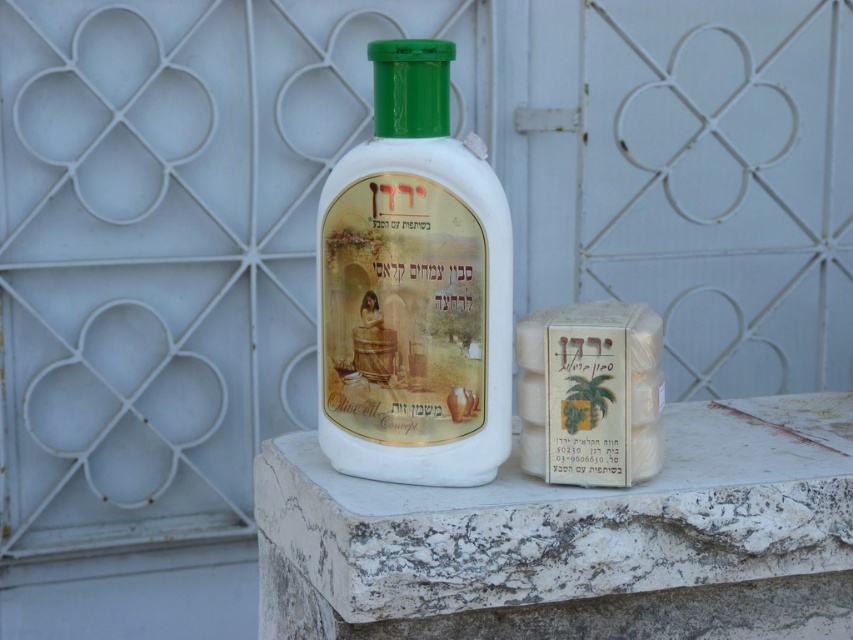
Question: Can you confirm if white marble at center is bigger than white matte bottle at center?

Choices:
 (A) no
 (B) yes

Answer: (B)

Question: Is white marble at center positioned behind white matte bottle at center?

Choices:
 (A) no
 (B) yes

Answer: (A)

Question: Does white matte bottle at center have a larger size compared to white matte soap at center?

Choices:
 (A) no
 (B) yes

Answer: (B)

Question: Estimate the real-world distances between objects in this image. Which object is farther from the white matte soap at center?

Choices:
 (A) white marble at center
 (B) white matte bottle at center

Answer: (A)

Question: Which point is farther to the camera?

Choices:
 (A) (358, 381)
 (B) (842, 436)

Answer: (B)

Question: Which point appears farthest from the camera in this image?

Choices:
 (A) (755, 484)
 (B) (610, 344)
 (C) (415, 371)

Answer: (A)